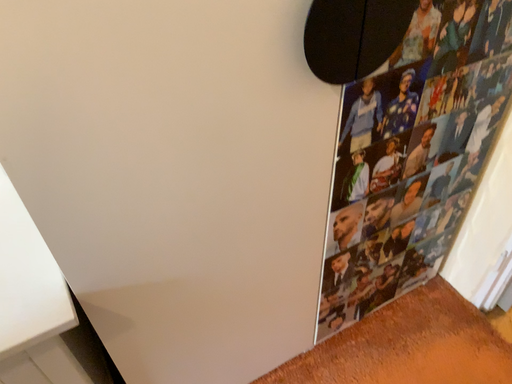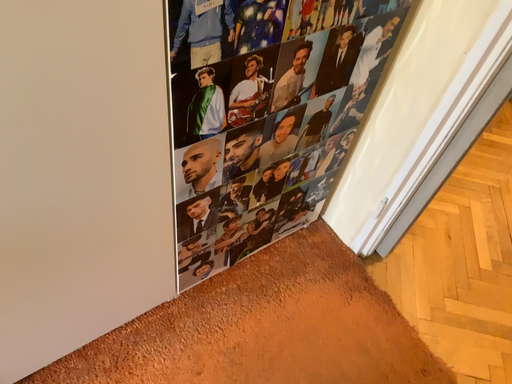
Question: Which way did the camera rotate in the video?

Choices:
 (A) rotated upward
 (B) rotated downward

Answer: (B)